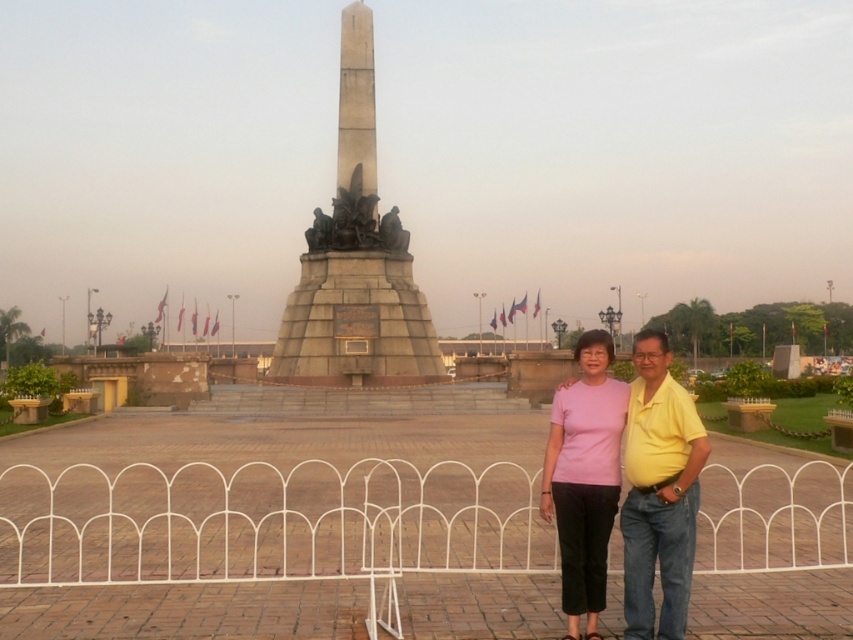
Question: Does white metal fence at center appear under pink matte shirt at center?

Choices:
 (A) no
 (B) yes

Answer: (B)

Question: Which point appears closest to the camera in this image?

Choices:
 (A) (648, 612)
 (B) (344, 282)

Answer: (A)

Question: Can you confirm if white metal fence at center is positioned to the right of pink matte shirt at center?

Choices:
 (A) no
 (B) yes

Answer: (A)

Question: Which object is the farthest from the pink matte shirt at center?

Choices:
 (A) white metal fence at center
 (B) gray stone monument at center

Answer: (B)

Question: Does white metal fence at center have a lesser width compared to pink matte shirt at center?

Choices:
 (A) yes
 (B) no

Answer: (B)

Question: Among these objects, which one is nearest to the camera?

Choices:
 (A) gray stone monument at center
 (B) white metal fence at center

Answer: (B)